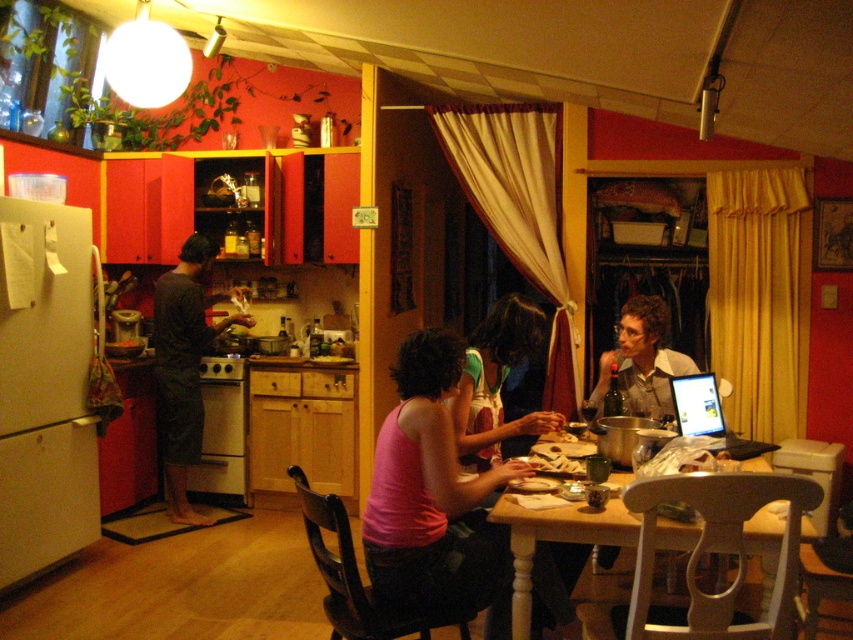
Question: Which object is the farthest from the dark gray fabric at left?

Choices:
 (A) pink fabric tank top at lower center
 (B) light brown wooden table at center

Answer: (B)

Question: Which is nearer to the silver metallic laptop at table right?

Choices:
 (A) light brown wooden table at center
 (B) pink fabric tank top at lower center

Answer: (A)

Question: Is light brown wooden table at center below silver metallic laptop at table right?

Choices:
 (A) no
 (B) yes

Answer: (B)

Question: Which object is closer to the camera taking this photo?

Choices:
 (A) pink fabric tank top at lower center
 (B) dark gray fabric at left
 (C) light brown wooden table at center

Answer: (C)

Question: Is light brown wooden table at center wider than silver metallic laptop at table right?

Choices:
 (A) no
 (B) yes

Answer: (B)

Question: Does pink fabric tank top at lower center appear on the left side of silver metallic laptop at table right?

Choices:
 (A) no
 (B) yes

Answer: (B)